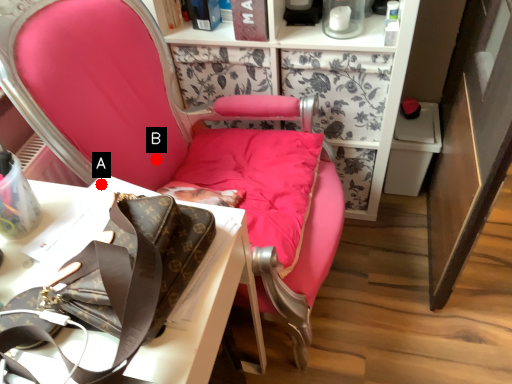
Question: Two points are circled on the image, labeled by A and B beside each circle. Which of the following is the farthest from the observer?

Choices:
 (A) A is further
 (B) B is further

Answer: (B)